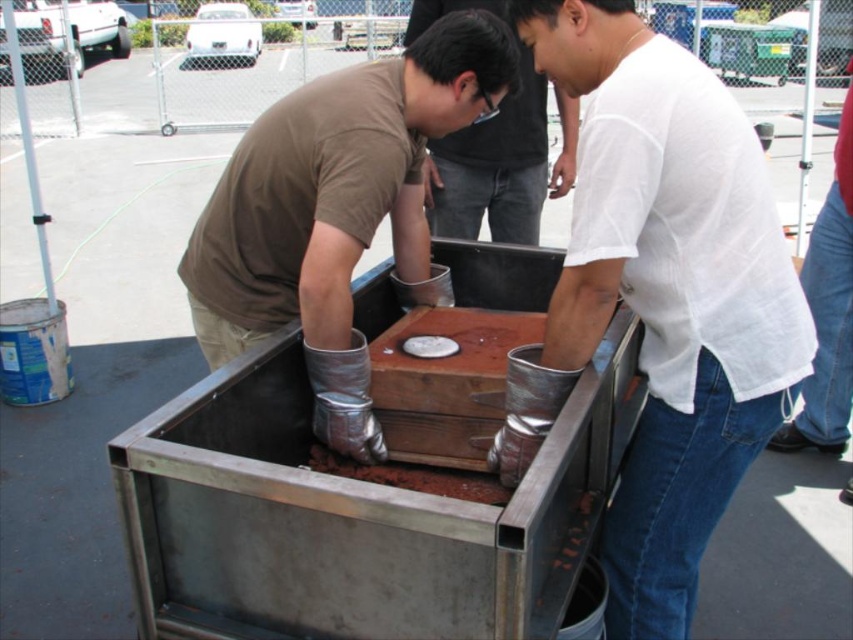
Does silver metallic gloves at center have a lesser width compared to matte black shirt at center?

No, silver metallic gloves at center is not thinner than matte black shirt at center.

Who is more distant from viewer, (277, 282) or (445, 224)?

The point (445, 224) is behind.

At what (x,y) coordinates should I click in order to perform the action: click on silver metallic gloves at center. Please return your answer as a coordinate pair (x, y). This screenshot has height=640, width=853. Looking at the image, I should click on (335, 188).